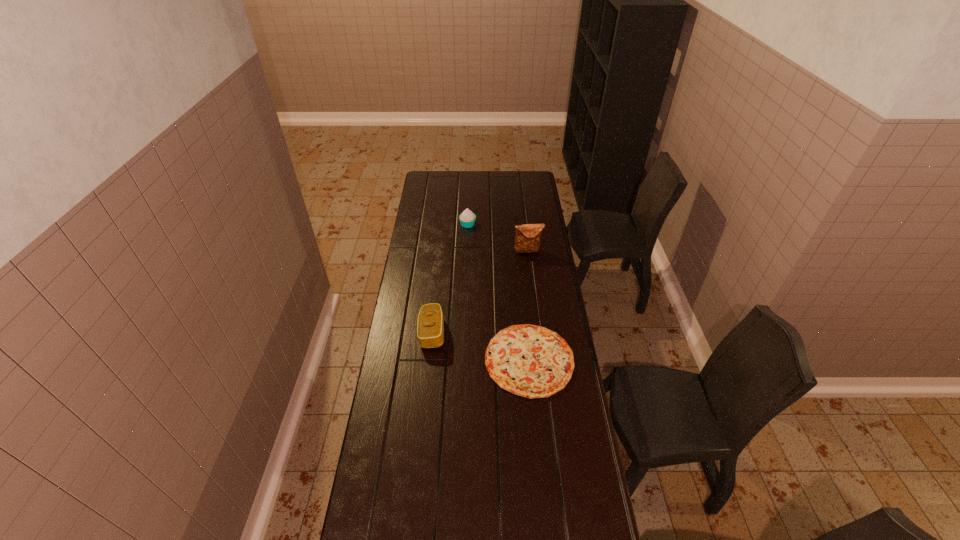
Point out which object is positioned as the third nearest to the farther clutch bag. Please provide its 2D coordinates. Your answer should be formatted as a tuple, i.e. [(x, y)], where the tuple contains the x and y coordinates of a point satisfying the conditions above.

[(430, 329)]

At what (x,y) coordinates should I click in order to perform the action: click on free space that satisfies the following two spatial constraints: 1. on the front side of the farthest object; 2. on the zipper side of the leftmost object. Please return your answer as a coordinate pair (x, y). The width and height of the screenshot is (960, 540). Looking at the image, I should click on (464, 333).

The image size is (960, 540). I want to click on vacant position in the image that satisfies the following two spatial constraints: 1. on the zipper side of the shortest object; 2. on the right side of the shorter clutch bag, so click(x=429, y=360).